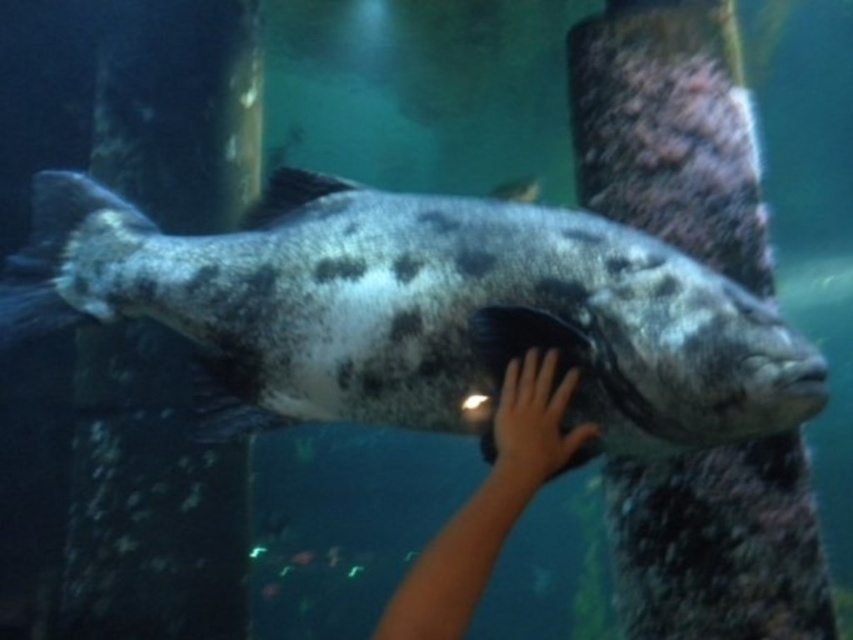
You are a marine biologist observing the aquarium. You need to determine if the speckled gray fish at center can swim above the smooth skin hand at center. Based on their sizes, can it do so?

The speckled gray fish at center is much taller than the smooth skin hand at center, so it can swim above the smooth skin hand at center because of its greater height.

You are a marine biologist observing the aquarium. You notice the speckled gray fish at center and the smooth skin hand at center. Which object is located higher in the image?

The speckled gray fish at center is positioned over the smooth skin hand at center, so it is higher in the image.

You are a marine biologist observing the aquarium. You notice the speckled gray fish at center and the smooth skin hand at center. Which object is positioned to the left of the other?

The speckled gray fish at center is to the left of the smooth skin hand at center.